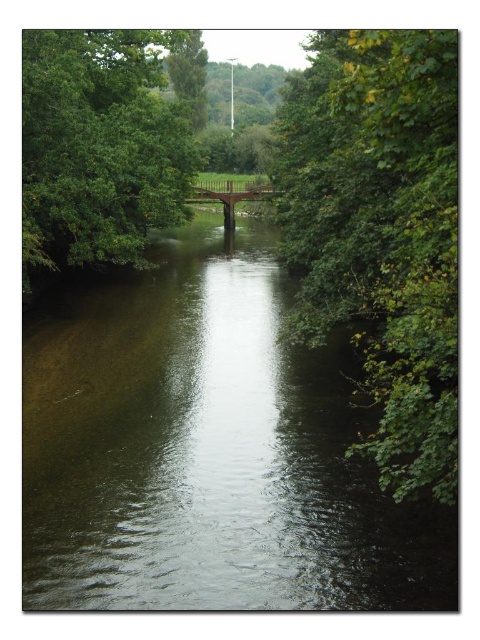
Based on the scene description, where is the green leafy tree at right located in the image?

The green leafy tree at right is located at the 2D coordinates point (381, 232).

You are a bird flying over the river scene. You see the green leafy tree at right and the green leafy tree at upper left. Which tree is located higher in the image?

The green leafy tree at right is positioned over the green leafy tree at upper left, so it is higher in the image.

You are standing at the center of the river in the image. Which direction should you look to see the green leafy tree at right?

The green leafy tree at right is located to your right side, so you should look to your right to see it.